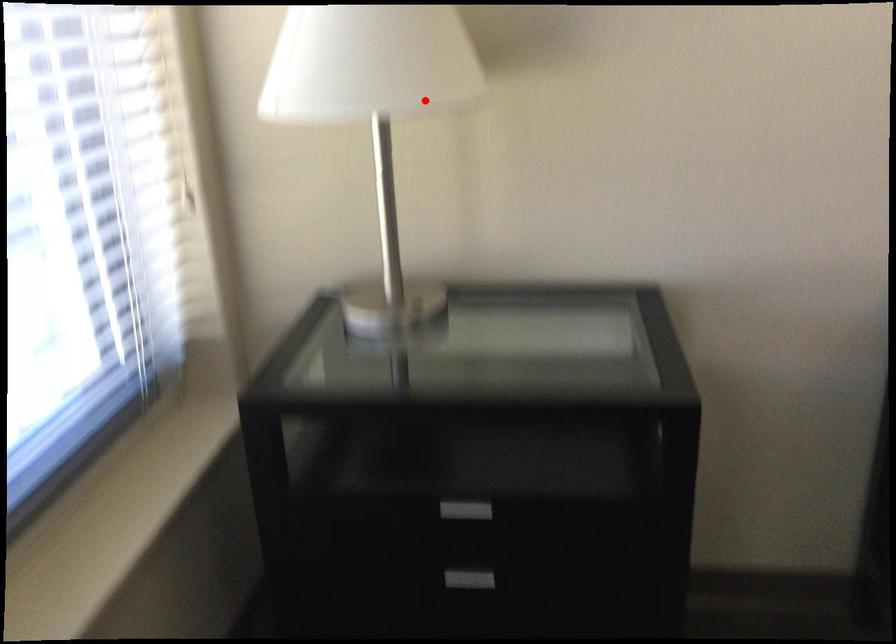
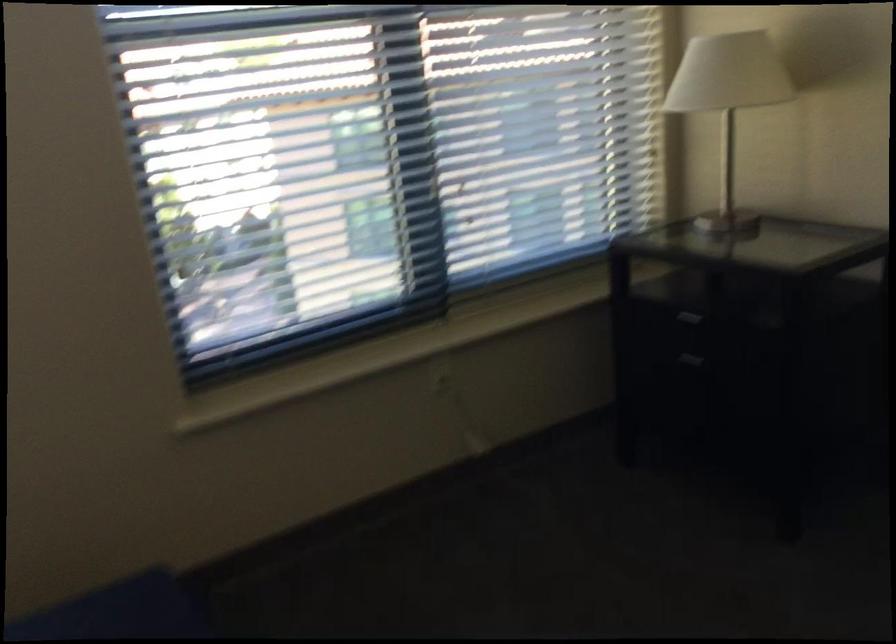
Question: I am providing you with two images of the same scene from different viewpoints. A red point is shown in image1. For the corresponding object point in image2, is it positioned nearer or farther from the camera?

Choices:
 (A) Nearer
 (B) Farther

Answer: (B)